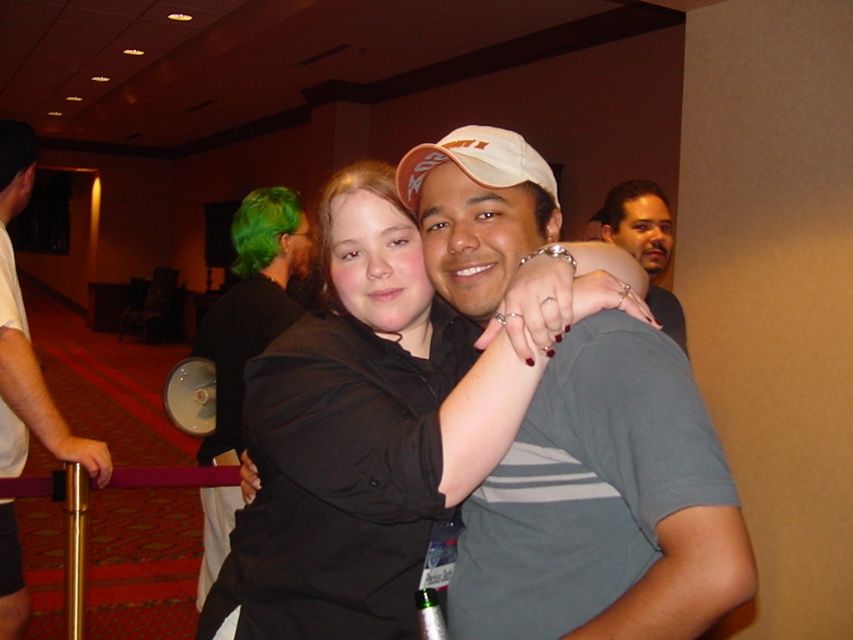
Question: Which point is farther to the camera?

Choices:
 (A) matte gray t-shirt at center
 (B) black fabric shirt at center
 (C) white matte shirt at center
 (D) gray cotton shirt at center

Answer: (D)

Question: Can you confirm if matte gray t-shirt at center is positioned below white matte shirt at center?

Choices:
 (A) yes
 (B) no

Answer: (B)

Question: In this image, where is matte gray t-shirt at center located relative to gray cotton shirt at center?

Choices:
 (A) left
 (B) right

Answer: (A)

Question: Does black fabric shirt at center have a lesser width compared to white matte shirt at center?

Choices:
 (A) yes
 (B) no

Answer: (B)

Question: Which of these objects is positioned closest to the gray cotton shirt at center?

Choices:
 (A) matte gray t-shirt at center
 (B) white matte shirt at center

Answer: (A)

Question: Which point is farther from the camera taking this photo?

Choices:
 (A) (16, 621)
 (B) (515, 627)

Answer: (A)